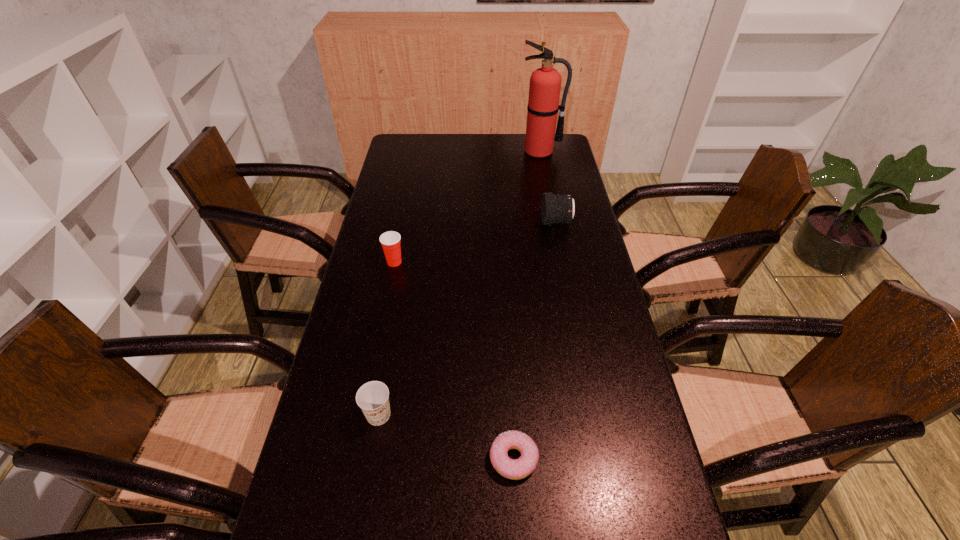
Where is `the farthest object`? This screenshot has width=960, height=540. the farthest object is located at coordinates (545, 83).

Identify the location of the tallest object. The image size is (960, 540). (545, 83).

I want to click on telephoto lens, so click(x=557, y=208).

Identify the location of the third farthest object. (390, 241).

Find the location of `the fourth tallest object`. the fourth tallest object is located at coordinates (373, 397).

At what (x,y) coordinates should I click in order to perform the action: click on the second nearest object. Please return your answer as a coordinate pair (x, y). Looking at the image, I should click on (373, 397).

At what (x,y) coordinates should I click in order to perform the action: click on the shortest object. Please return your answer as a coordinate pair (x, y). The image size is (960, 540). Looking at the image, I should click on (515, 469).

The height and width of the screenshot is (540, 960). Identify the location of doughnut. (515, 469).

Where is `vacant space located at the nozzle of the fire extinguisher`? vacant space located at the nozzle of the fire extinguisher is located at coordinates (542, 166).

Identify the location of free space located 0.230m at the front element of the fourth nearest object. (474, 222).